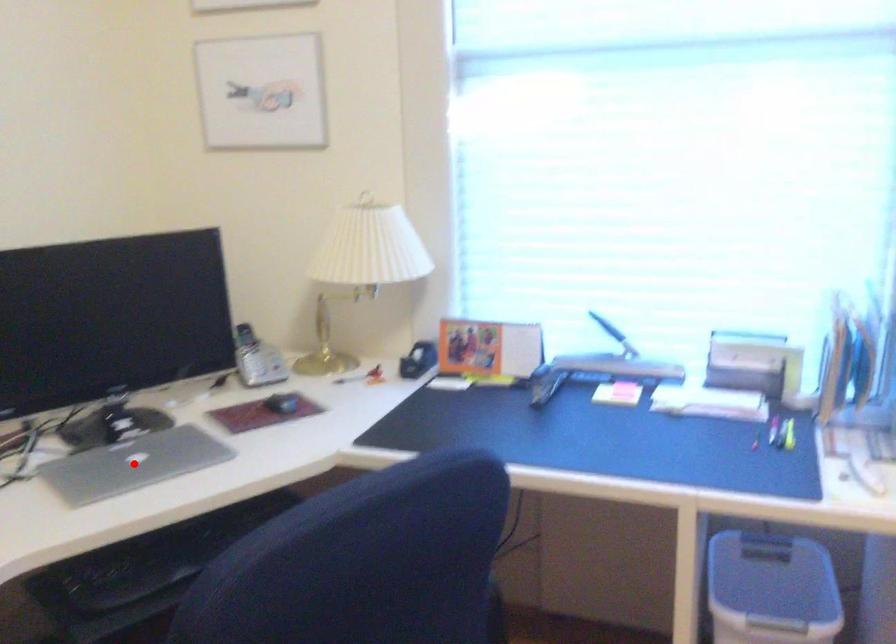
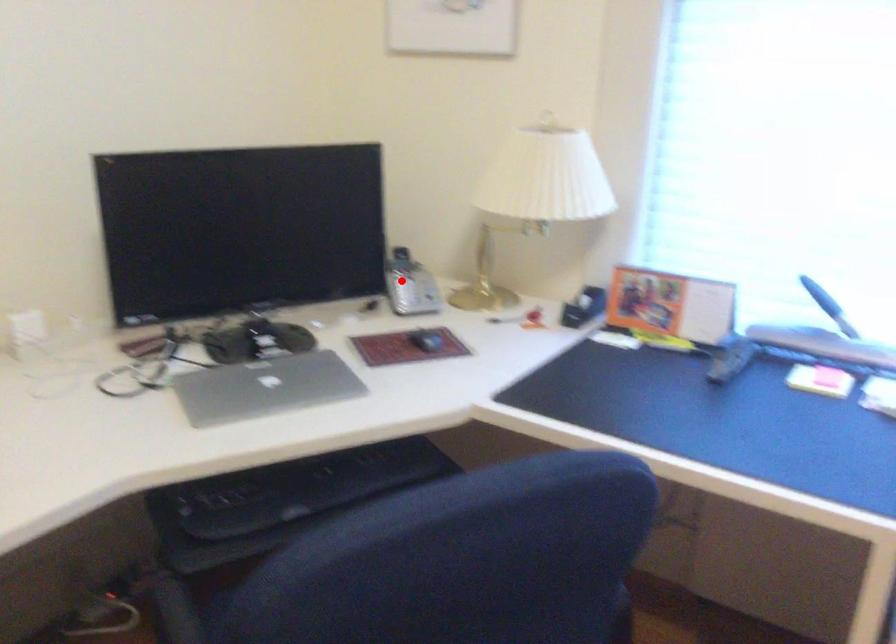
I am providing you with two images of the same scene from different viewpoints. A red point is marked on the first image and another point is marked on the second image. Are the points marked in image1 and image2 representing the same 3D position?

No